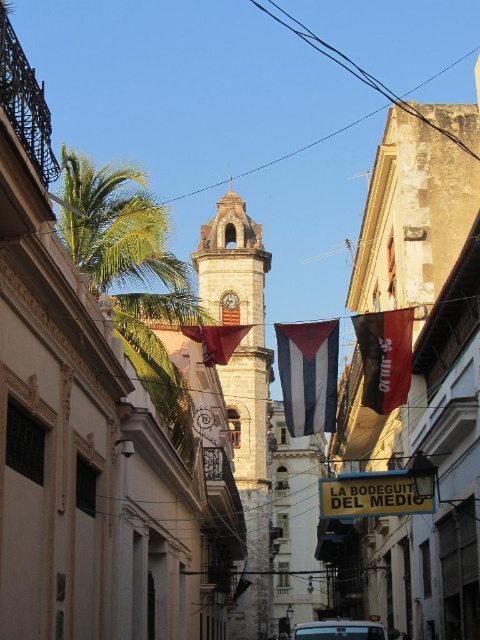
Does stone clock tower at center have a lesser width compared to black fabric flag at center?

No.

Which is more to the left, stone clock tower at center or black fabric flag at center?

From the viewer's perspective, stone clock tower at center appears more on the left side.

Is point (202, 280) closer to camera compared to point (377, 314)?

No, (202, 280) is further to viewer.

What are the coordinates of `stone clock tower at center` in the screenshot? It's located at (243, 388).

Does striped fabric flag at center lie in front of metallic silver car at center?

Yes, it is in front of metallic silver car at center.

Who is positioned more to the left, striped fabric flag at center or metallic silver car at center?

striped fabric flag at center

Is point (300, 424) closer to viewer compared to point (360, 627)?

Yes, it is.

The height and width of the screenshot is (640, 480). Identify the location of striped fabric flag at center. (308, 374).

Does striped fabric flag at center appear on the left side of black fabric flag at center?

Indeed, striped fabric flag at center is positioned on the left side of black fabric flag at center.

Based on the photo, is striped fabric flag at center behind black fabric flag at center?

No, it is not.

Which is in front, point (313, 413) or point (362, 346)?

Point (313, 413) is in front.

Find the location of a particular element. This screenshot has width=480, height=640. striped fabric flag at center is located at coordinates 308,374.